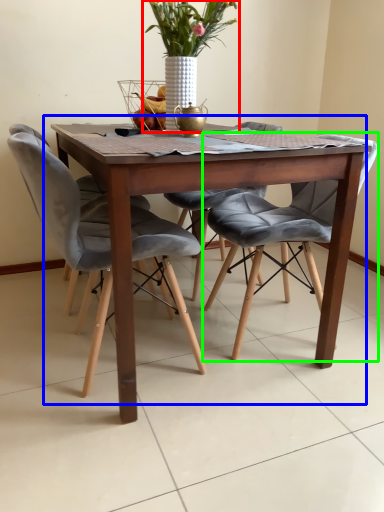
Question: Which is farther away from houseplant (highlighted by a red box)? kitchen & dining room table (highlighted by a blue box) or chair (highlighted by a green box)?

Choices:
 (A) kitchen & dining room table
 (B) chair

Answer: (B)